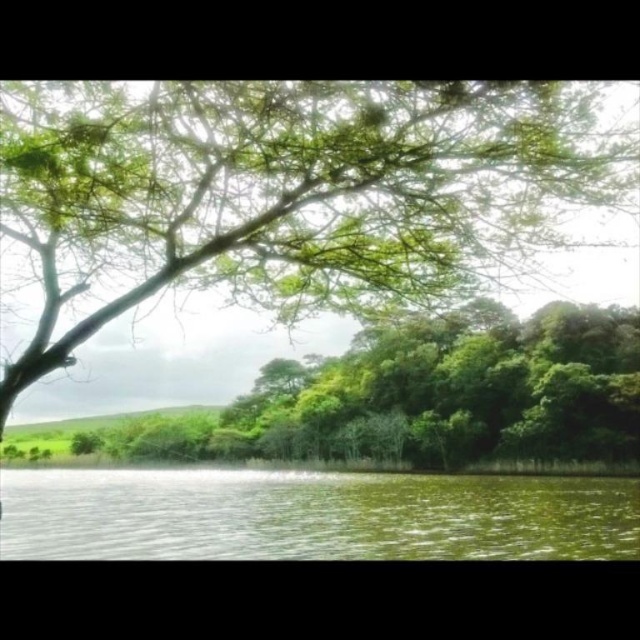
Question: Which point appears farthest from the camera in this image?

Choices:
 (A) (56, 99)
 (B) (284, 538)

Answer: (B)

Question: Does green leafy tree at upper left have a smaller size compared to green liquid at lower center?

Choices:
 (A) no
 (B) yes

Answer: (B)

Question: Which point appears farthest from the camera in this image?

Choices:
 (A) (272, 120)
 (B) (90, 531)

Answer: (B)

Question: Which object is farther from the camera taking this photo?

Choices:
 (A) green liquid at lower center
 (B) green leafy tree at upper left

Answer: (A)

Question: Is green leafy tree at upper left thinner than green liquid at lower center?

Choices:
 (A) no
 (B) yes

Answer: (B)

Question: Can you confirm if green leafy tree at upper left is positioned to the right of green liquid at lower center?

Choices:
 (A) no
 (B) yes

Answer: (B)